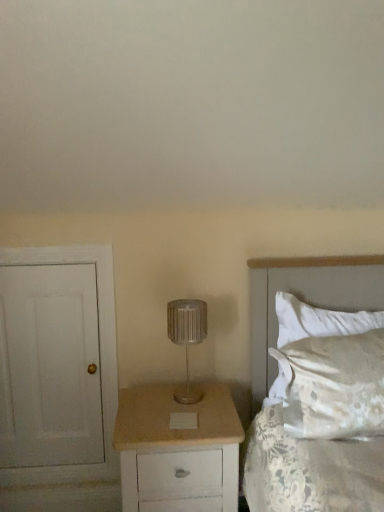
Where is `blank space above beige wood chest of drawers at center (from a real-world perspective)`? The height and width of the screenshot is (512, 384). blank space above beige wood chest of drawers at center (from a real-world perspective) is located at coordinates (178, 407).